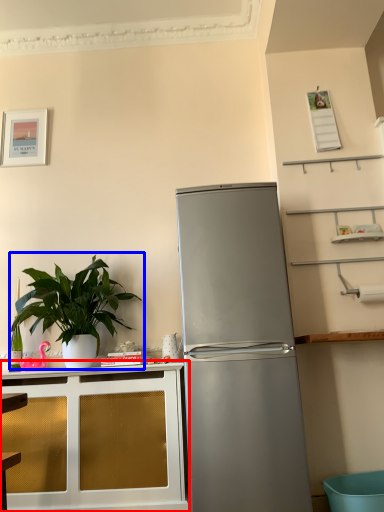
Question: Which point is closer to the camera, cabinetry (highlighted by a red box) or houseplant (highlighted by a blue box)?

Choices:
 (A) cabinetry
 (B) houseplant

Answer: (A)